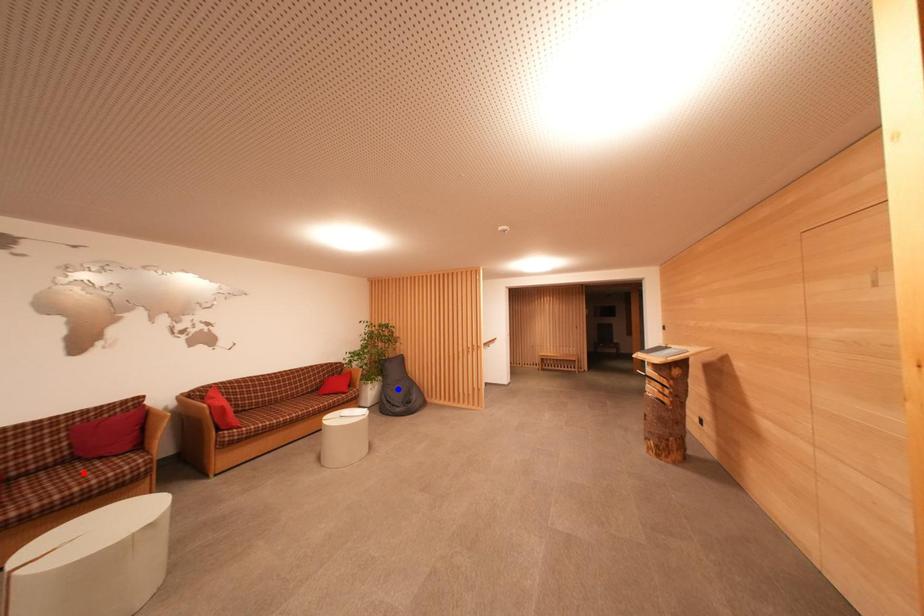
Question: Two points are marked on the image. Which point is closer to the camera?

Choices:
 (A) Blue point is closer.
 (B) Red point is closer.

Answer: (B)